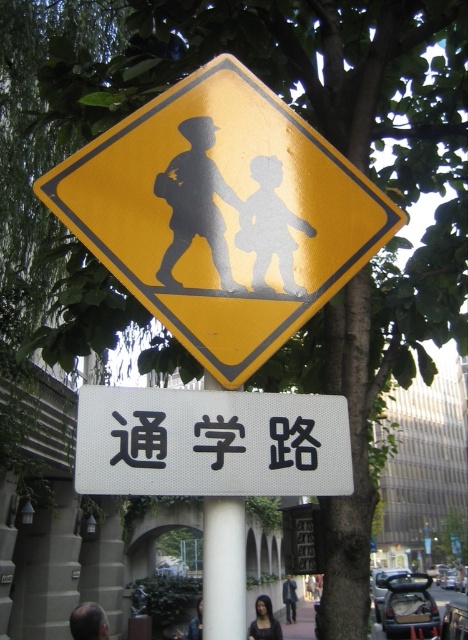
Looking at this image, can you confirm if blackmaterial/texturesign at center is thinner than dark hair at lower center?

Correct, blackmaterial/texturesign at center's width is less than dark hair at lower center's.

Is blackmaterial/texturesign at center to the right of dark hair at lower center from the viewer's perspective?

Incorrect, blackmaterial/texturesign at center is not on the right side of dark hair at lower center.

I want to click on blackmaterial/texturesign at center, so click(141, 440).

What do you see at coordinates (211, 442) in the screenshot? I see `white textured sign at center` at bounding box center [211, 442].

From the picture: Is white textured sign at center wider than blue fabric pedestrian at lower center?

Yes.

Between point (287, 436) and point (289, 589), which one is positioned in front?

Point (287, 436) is in front.

Where is `white textured sign at center`? white textured sign at center is located at coordinates pos(211,442).

Who is shorter, yellow matte pedestrian crossing sign at upper center or dark gray fabric pedestrian at lower center?

Standing shorter between the two is dark gray fabric pedestrian at lower center.

Is yellow matte pedestrian crossing sign at upper center positioned behind dark gray fabric pedestrian at lower center?

No, it is in front of dark gray fabric pedestrian at lower center.

Is point (216, 193) closer to camera compared to point (197, 627)?

Yes, point (216, 193) is closer to viewer.

Where is `yellow matte pedestrian crossing sign at upper center`? The image size is (468, 640). yellow matte pedestrian crossing sign at upper center is located at coordinates (221, 214).